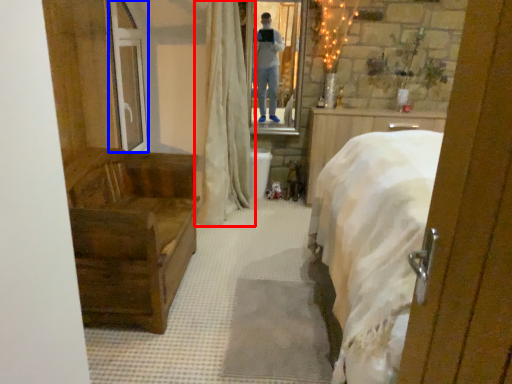
Question: Which object is further to the camera taking this photo, curtain (highlighted by a red box) or glass door (highlighted by a blue box)?

Choices:
 (A) curtain
 (B) glass door

Answer: (B)